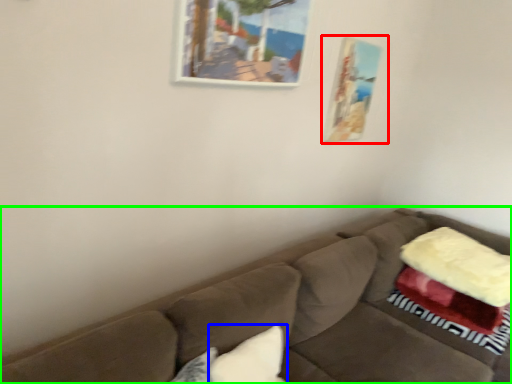
Question: Which object is the closest to the picture frame (highlighted by a red box)? Choose among these: pillow (highlighted by a blue box) or studio couch (highlighted by a green box).

Choices:
 (A) pillow
 (B) studio couch

Answer: (B)